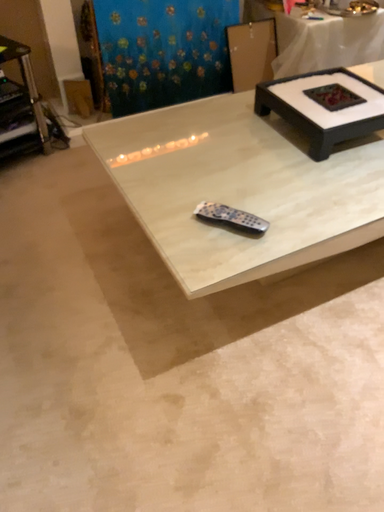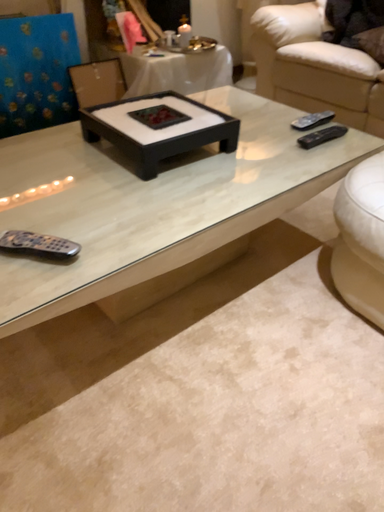
Question: Which way did the camera rotate in the video?

Choices:
 (A) rotated downward
 (B) rotated upward

Answer: (B)